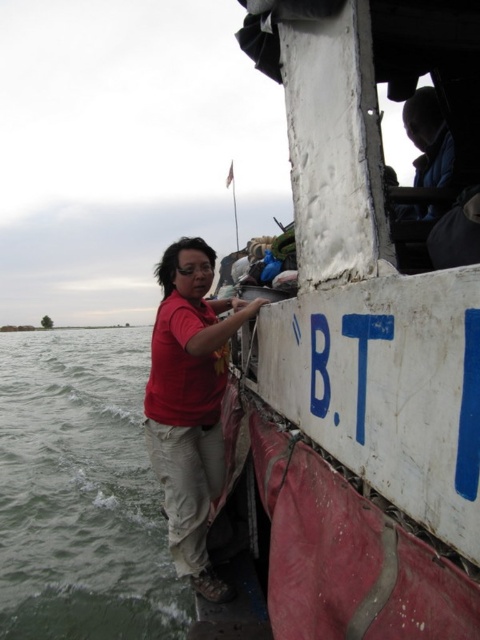
Question: Which is nearer to the white matte boat at upper right?

Choices:
 (A) green water at lower left
 (B) matte red shirt at center

Answer: (B)

Question: Considering the real-world distances, which object is farthest from the green water at lower left?

Choices:
 (A) white matte boat at upper right
 (B) matte red shirt at center

Answer: (B)

Question: Can you confirm if white matte boat at upper right is positioned above matte red shirt at center?

Choices:
 (A) yes
 (B) no

Answer: (A)

Question: Can you confirm if green water at lower left is bigger than matte red shirt at center?

Choices:
 (A) no
 (B) yes

Answer: (B)

Question: Considering the relative positions of white matte boat at upper right and matte red shirt at center in the image provided, where is white matte boat at upper right located with respect to matte red shirt at center?

Choices:
 (A) right
 (B) left

Answer: (A)

Question: Which object is the farthest from the white matte boat at upper right?

Choices:
 (A) matte red shirt at center
 (B) green water at lower left

Answer: (B)